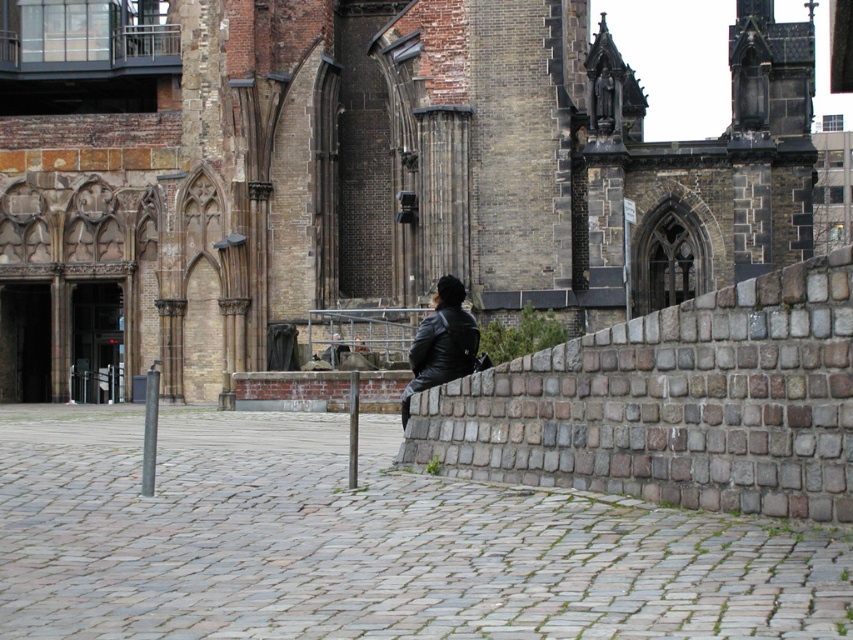
Which is below, brown stone church at center or black leather jacket at center?

black leather jacket at center

Is brown stone church at center thinner than black leather jacket at center?

No, brown stone church at center is not thinner than black leather jacket at center.

Who is more distant from viewer, (785, 166) or (451, 321)?

The point (785, 166) is behind.

The height and width of the screenshot is (640, 853). In order to click on brown stone church at center in this screenshot , I will do `click(360, 173)`.